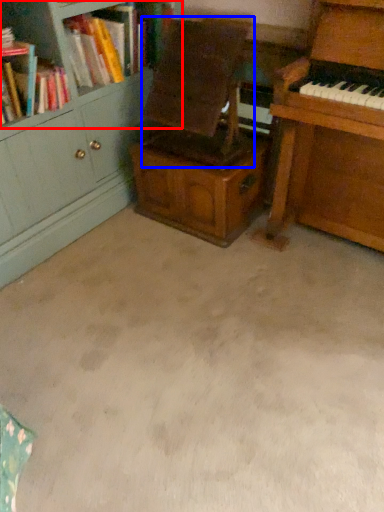
Question: Among these objects, which one is nearest to the camera, bookcase (highlighted by a red box) or armchair (highlighted by a blue box)?

Choices:
 (A) bookcase
 (B) armchair

Answer: (B)